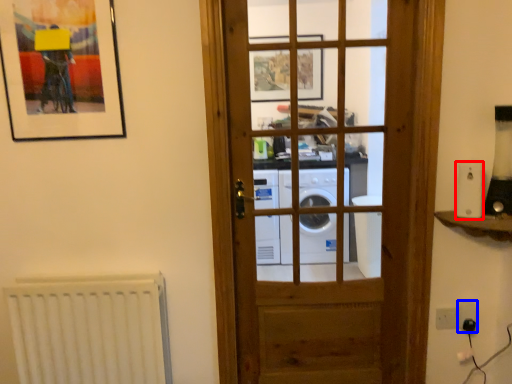
Question: Which object appears closest to the camera in this image, appliance (highlighted by a red box) or electric outlet (highlighted by a blue box)?

Choices:
 (A) appliance
 (B) electric outlet

Answer: (A)